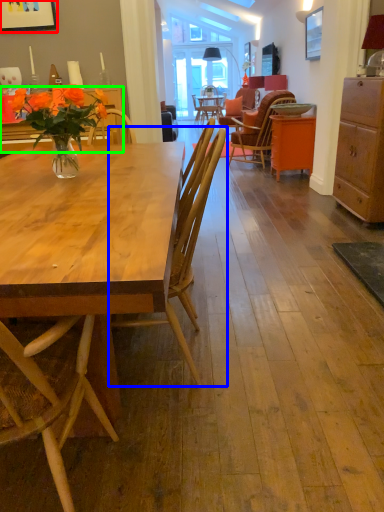
Question: Considering the real-world distances, which object is farthest from picture frame (highlighted by a red box)? chair (highlighted by a blue box) or desk (highlighted by a green box)?

Choices:
 (A) chair
 (B) desk

Answer: (A)